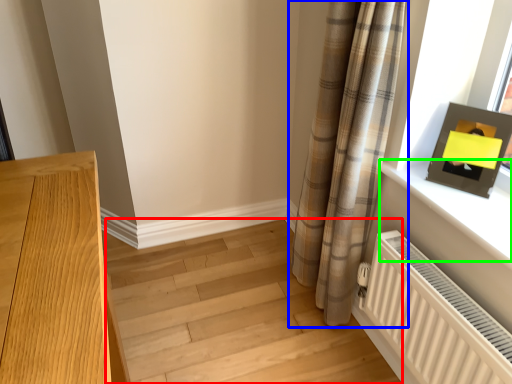
Question: Which object is the farthest from stairwell (highlighted by a red box)? Choose among these: curtain (highlighted by a blue box) or window sill (highlighted by a green box).

Choices:
 (A) curtain
 (B) window sill

Answer: (B)